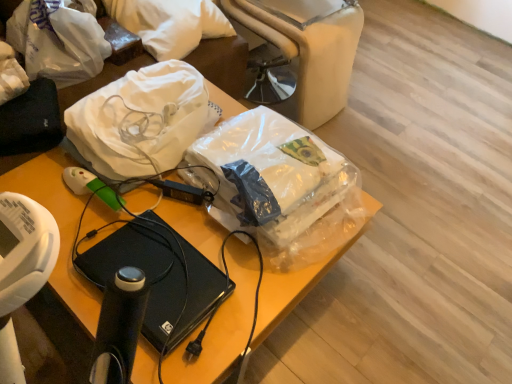
You are a GUI agent. You are given a task and a screenshot of the screen. Output one action in this format:
    pyautogui.click(x=<x>, y=<y>)
    Task: Click on the free space between translucent plastic bag at center, which appears as the 1th plastic bag when viewed from the right, and transparent plastic bag at upper center, the 2th plastic bag in the left-to-right sequence
    
    Given the screenshot: What is the action you would take?
    pyautogui.click(x=197, y=221)